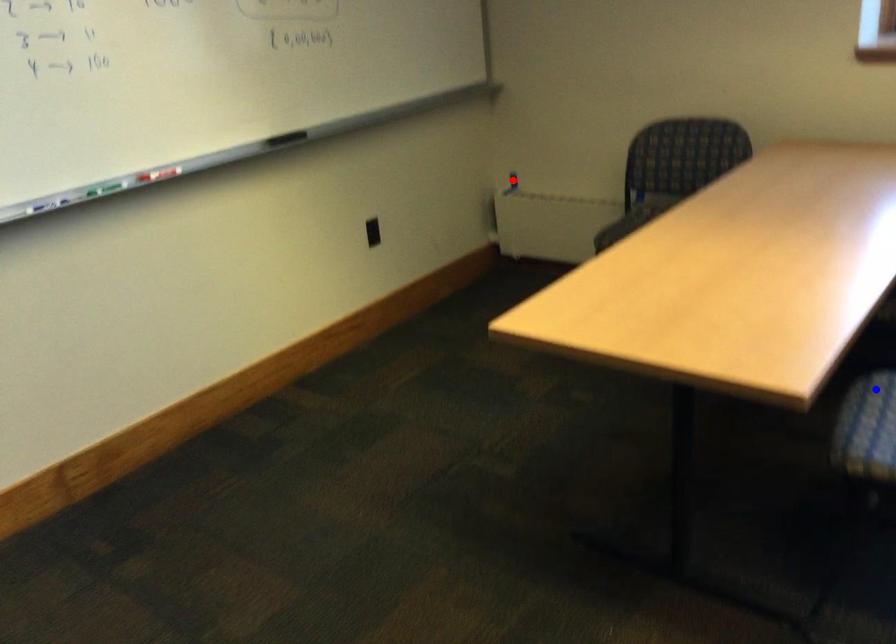
Question: In the image, two points are highlighted. Which point is nearer to the camera? Reply with the corresponding letter.

Choices:
 (A) blue point
 (B) red point

Answer: (A)